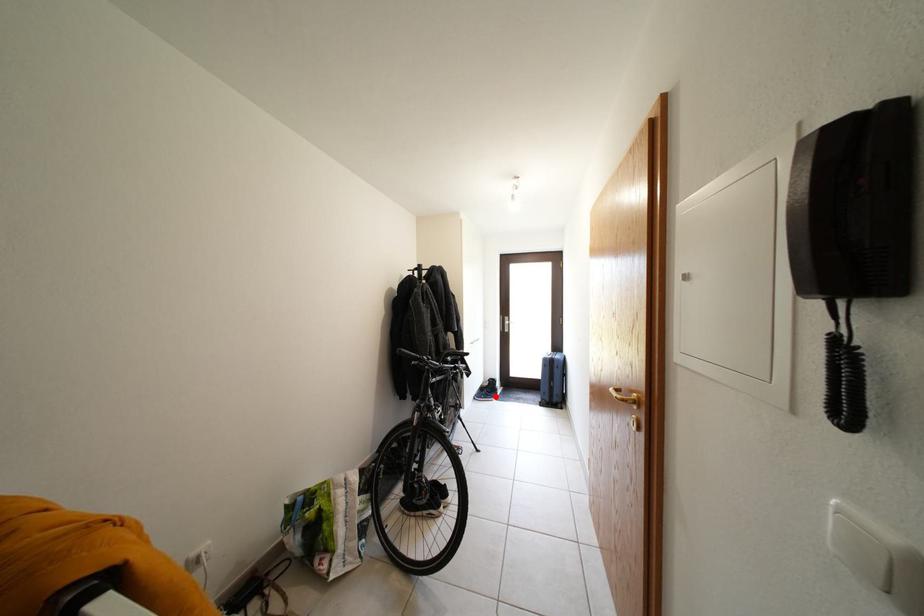
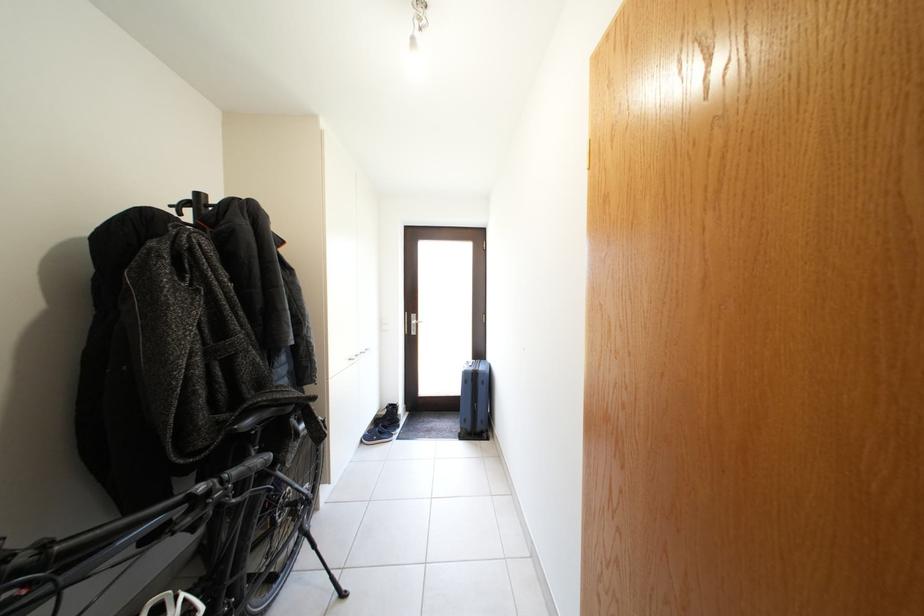
Where in the second image is the point corresponding to the highlighted location from the first image?

(392, 431)